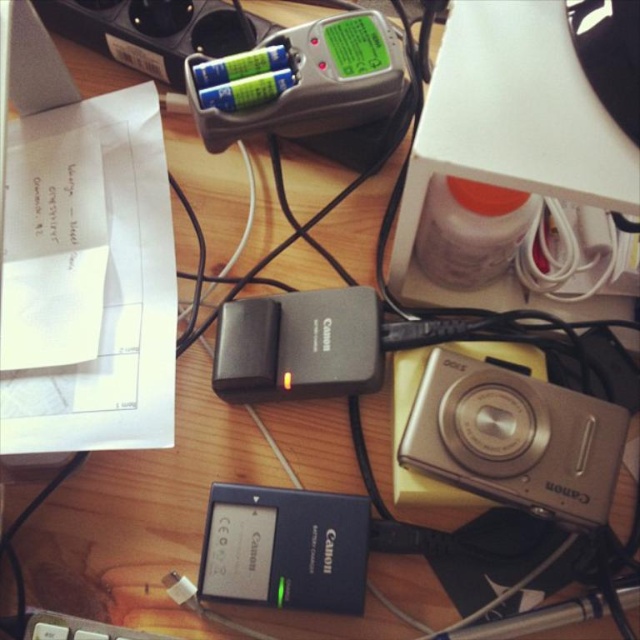
Between black plastic battery charger at bottom and black plastic battery charger at center, which one has less height?

With less height is black plastic battery charger at bottom.

Which is behind, point (358, 589) or point (301, 292)?

Point (301, 292)

Between point (314, 563) and point (337, 337), which one is positioned in front?

Positioned in front is point (314, 563).

Find the location of a particular element. The height and width of the screenshot is (640, 640). black plastic battery charger at bottom is located at coordinates (284, 548).

Who is more forward, (432, 426) or (230, 122)?

Positioned in front is point (432, 426).

Which is in front, point (419, 416) or point (387, 52)?

Point (419, 416) is more forward.

Identify the location of silver metallic camera at lower right. (515, 438).

Between silver metallic camera at lower right and black plastic battery charger at bottom, which one is positioned higher?

silver metallic camera at lower right

Is point (512, 387) positioned after point (221, 508)?

That is False.

You are a GUI agent. You are given a task and a screenshot of the screen. Output one action in this format:
    pyautogui.click(x=<x>, y=<y>)
    Task: Click on the silver metallic camera at lower right
    Image resolution: width=640 pixels, height=640 pixels.
    Given the screenshot: What is the action you would take?
    pyautogui.click(x=515, y=438)